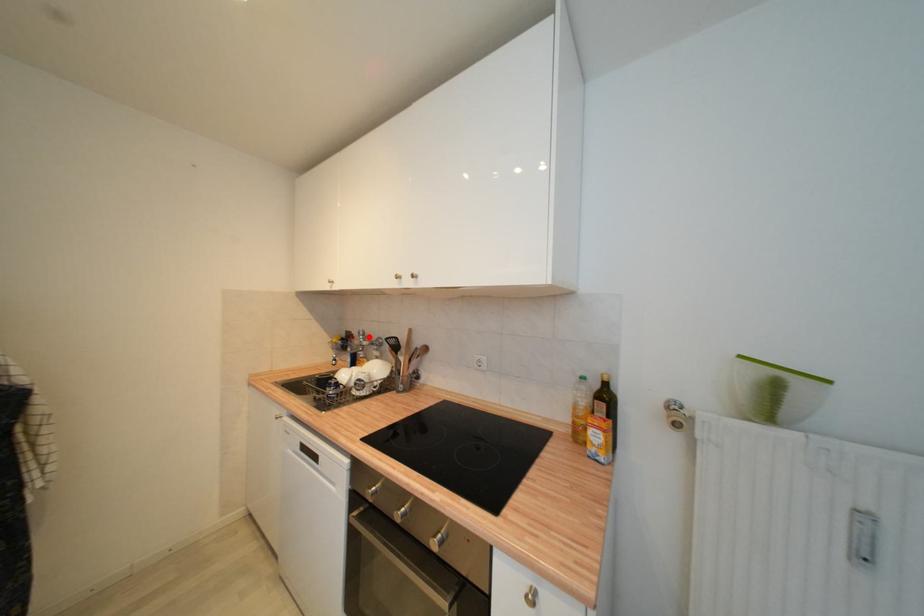
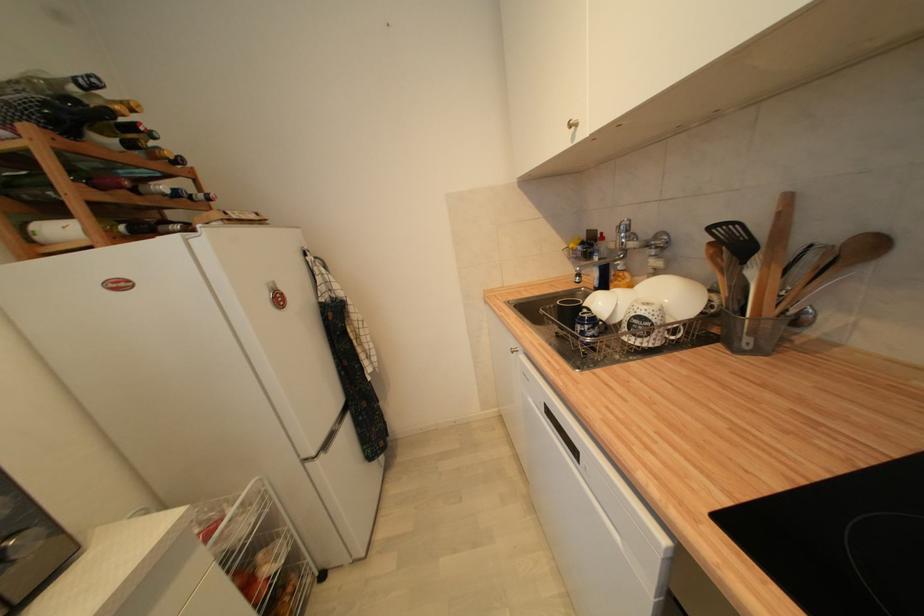
The point at the highlighted location is marked in the first image. Where is the corresponding point in the second image?

(633, 233)